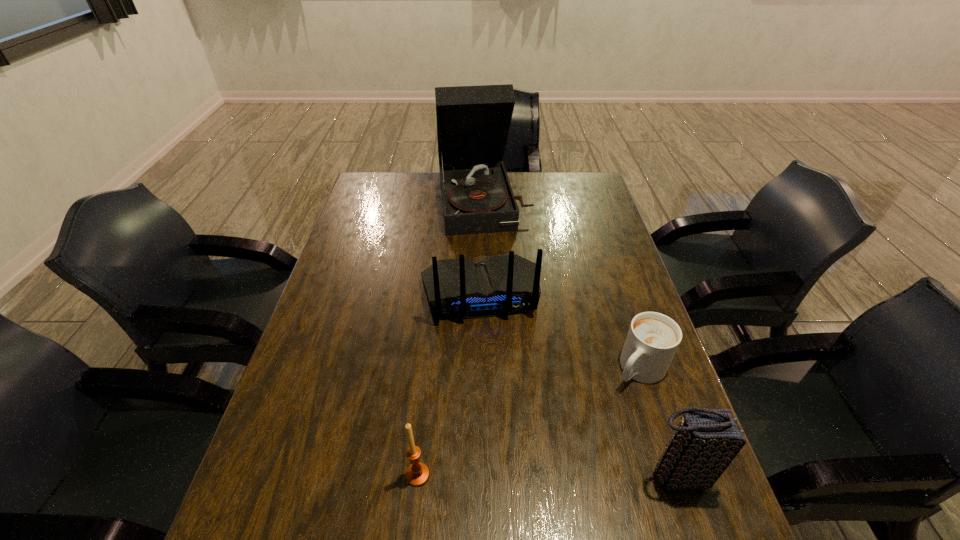
Find the location of `vacant area that lies between the third farthest object and the candle_holder`. vacant area that lies between the third farthest object and the candle_holder is located at coordinates (528, 422).

You are a GUI agent. You are given a task and a screenshot of the screen. Output one action in this format:
    pyautogui.click(x=<x>, y=<y>)
    Task: Click on the unoccupied position between the clutch bag and the router
    This screenshot has width=960, height=540.
    Given the screenshot: What is the action you would take?
    pyautogui.click(x=578, y=385)

This screenshot has height=540, width=960. Identify the location of free space between the clutch bag and the tallest object. (580, 338).

Find the location of `vacant space in between the cappuccino and the clutch bag`. vacant space in between the cappuccino and the clutch bag is located at coordinates (658, 422).

I want to click on blank region between the clutch bag and the fourth nearest object, so click(578, 385).

In order to click on empty space between the shortest object and the phonograph_record in this screenshot , I will do `click(562, 285)`.

The image size is (960, 540). I want to click on the third closest object to the shortest object, so 417,475.

Identify which object is located as the nearest to the clutch bag. Please provide its 2D coordinates. Your answer should be formatted as a tuple, i.e. [(x, y)], where the tuple contains the x and y coordinates of a point satisfying the conditions above.

[(653, 338)]

Find the location of `free space in the image that satisfies the following two spatial constraints: 1. on the back side of the candle_holder; 2. on the left side of the shortest object`. free space in the image that satisfies the following two spatial constraints: 1. on the back side of the candle_holder; 2. on the left side of the shortest object is located at coordinates (429, 369).

In order to click on vacant space that satisfies the following two spatial constraints: 1. on the back side of the farthest object; 2. on the right side of the second farthest object in this screenshot , I will do `click(480, 201)`.